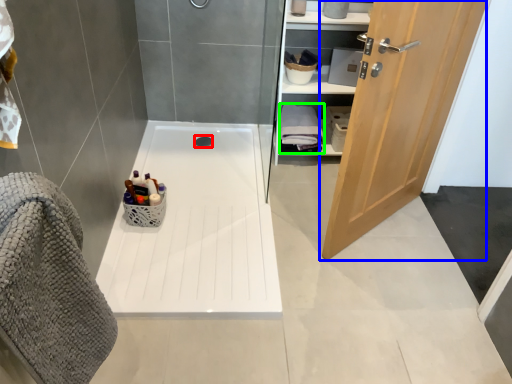
Question: Estimate the real-world distances between objects in this image. Which object is farther from drain (highlighted by a red box), door (highlighted by a blue box) or bath towel (highlighted by a green box)?

Choices:
 (A) door
 (B) bath towel

Answer: (A)